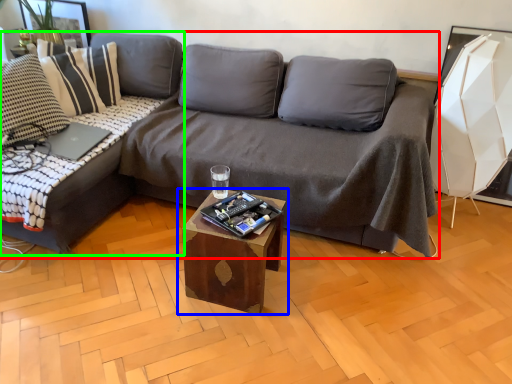
Question: Estimate the real-world distances between objects in this image. Which object is farther from studio couch (highlighted by a red box), table (highlighted by a blue box) or studio couch (highlighted by a green box)?

Choices:
 (A) table
 (B) studio couch

Answer: (B)